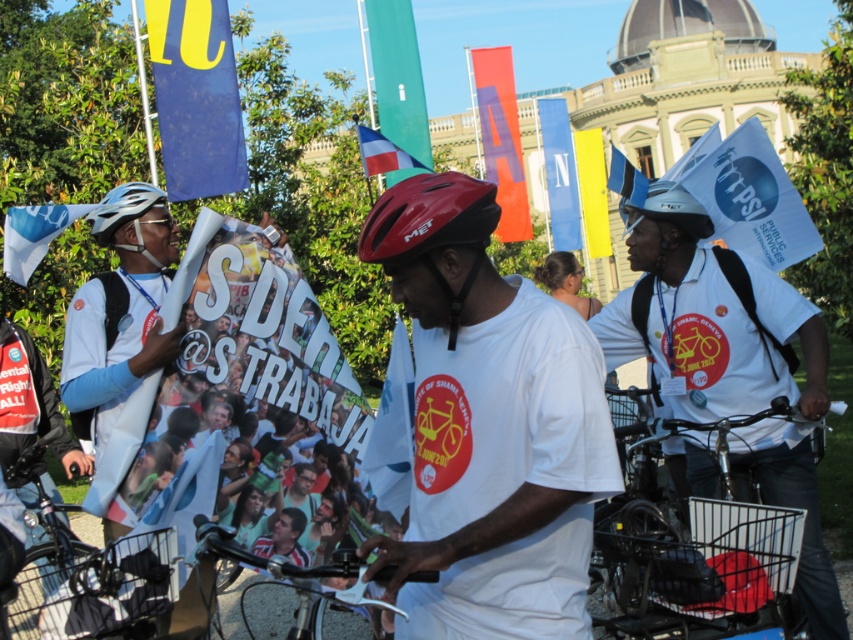
You are a photographer at the event and want to capture a photo that includes both the matte blue helmet at left and the orange fabric banner at upper center. Which object should you focus on first to ensure both are in the frame?

The matte blue helmet at left is located below the orange fabric banner at upper center. To include both in the frame, focus on the orange fabric banner at upper center first as it is higher up, then adjust the camera angle downward to include the matte blue helmet at left.

You are a photographer at the event and want to capture a photo of the shiny red helmet at center without the blue fabric flag at left blocking it. How should you adjust your position?

Move to the right side so the shiny red helmet at center is no longer under the blue fabric flag at left, ensuring the flag does not block the helmet.

You are a photographer at the event and want to capture a clear shot of both the shiny metallic bicycle handlebars at center and the orange fabric banner at upper center. Which object should you focus on first to ensure it appears larger in the photo?

You should focus on the shiny metallic bicycle handlebars at center first because it is larger in size than the orange fabric banner at upper center, so capturing it properly will ensure it looks prominent in the photo.